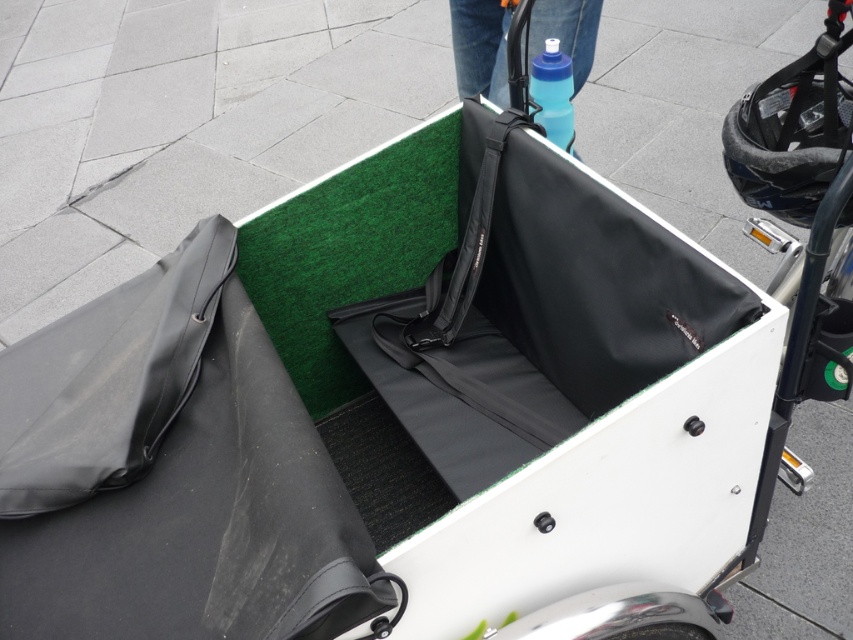
Who is positioned more to the left, black matte bag at lower left or black fabric strap at center?

From the viewer's perspective, black matte bag at lower left appears more on the left side.

Can you confirm if black matte bag at lower left is positioned below black fabric strap at center?

Yes, black matte bag at lower left is below black fabric strap at center.

Who is more forward, (149, 448) or (415, 330)?

Point (149, 448)

This screenshot has height=640, width=853. What are the coordinates of `black matte bag at lower left` in the screenshot? It's located at (172, 472).

Which is behind, point (566, 26) or point (556, 108)?

The point (566, 26) is more distant.

Is point (474, 6) positioned behind point (547, 70)?

Yes.

Where is `blue matte water bottle at upper center`? The width and height of the screenshot is (853, 640). blue matte water bottle at upper center is located at coordinates (480, 48).

Consider the image. Is blue matte water bottle at upper center below metallic silver wheel at lower center?

Actually, blue matte water bottle at upper center is above metallic silver wheel at lower center.

In the scene shown: Does blue matte water bottle at upper center have a lesser height compared to metallic silver wheel at lower center?

In fact, blue matte water bottle at upper center may be taller than metallic silver wheel at lower center.

What do you see at coordinates (480, 48) in the screenshot?
I see `blue matte water bottle at upper center` at bounding box center [480, 48].

Locate an element on the screen. Image resolution: width=853 pixels, height=640 pixels. blue matte water bottle at upper center is located at coordinates (480, 48).